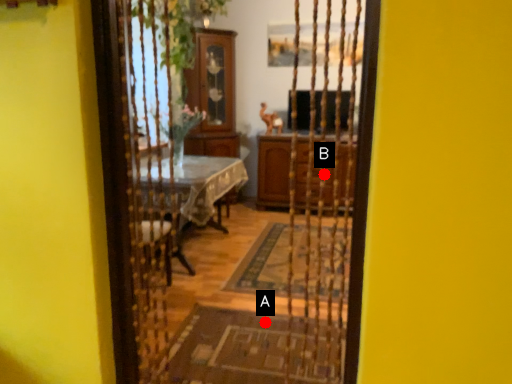
Question: Two points are circled on the image, labeled by A and B beside each circle. Which of the following is the closest to the observer?

Choices:
 (A) A is closer
 (B) B is closer

Answer: (A)